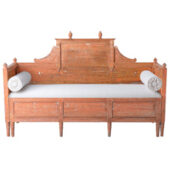
At what (x,y) coordinates should I click in order to perform the action: click on bench leg 5. Please return your answer as a coordinate pair (x, y). The width and height of the screenshot is (170, 170). Looking at the image, I should click on (157, 133).